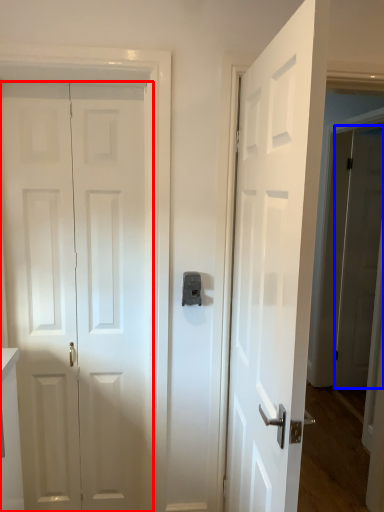
Question: Which object appears farthest to the camera in this image, door (highlighted by a red box) or door (highlighted by a blue box)?

Choices:
 (A) door
 (B) door

Answer: (B)